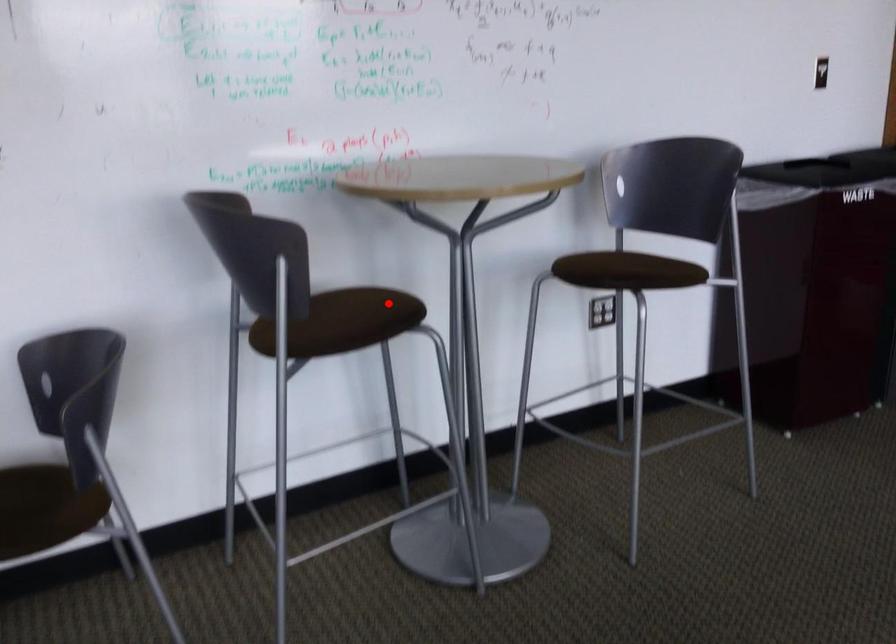
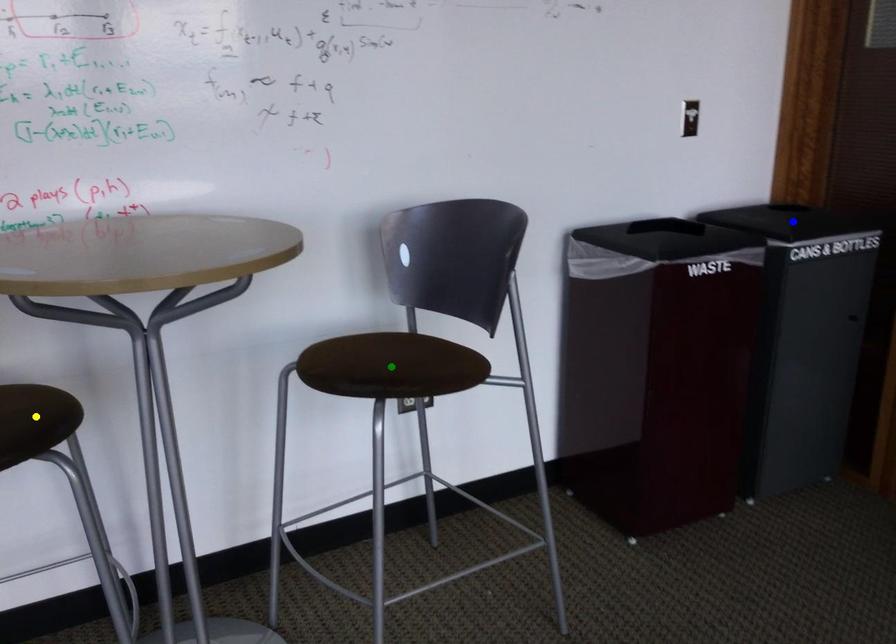
Question: I am providing you with two images of the same scene from different viewpoints. A red point is marked on the first image. You are given multiple points on the second image. Which point in image 2 represents the same 3d spot as the red point in image 1?

Choices:
 (A) yellow point
 (B) green point
 (C) blue point

Answer: (A)